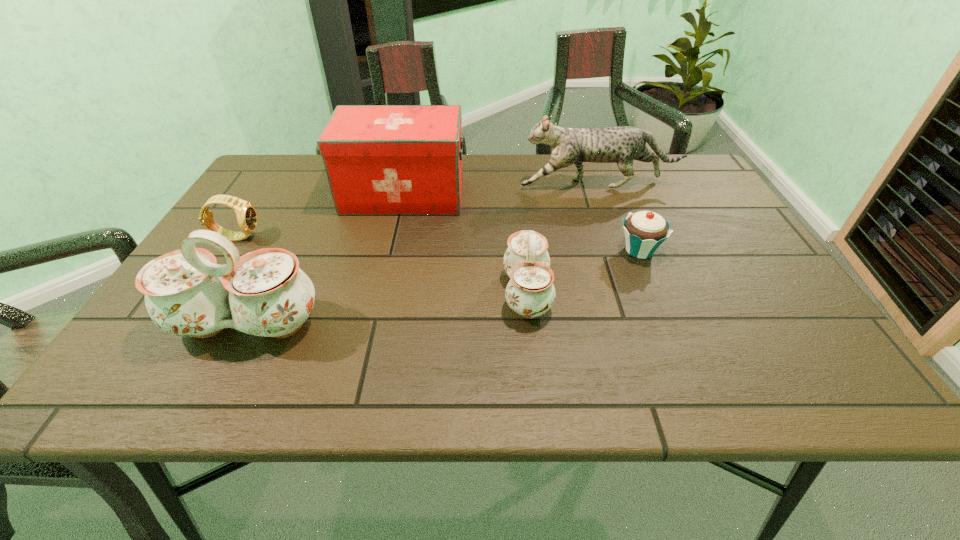
Identify the location of vacant area that satisfies the following two spatial constraints: 1. on the handle side of the cupcake; 2. on the right side of the first-aid kit. The width and height of the screenshot is (960, 540). (391, 251).

This screenshot has height=540, width=960. Find the location of `free space that satisfies the following two spatial constraints: 1. on the face of the cupcake; 2. on the left side of the watch`. free space that satisfies the following two spatial constraints: 1. on the face of the cupcake; 2. on the left side of the watch is located at coordinates (228, 251).

Locate an element on the screen. This screenshot has width=960, height=540. free location that satisfies the following two spatial constraints: 1. on the handle side of the first-aid kit; 2. by the handle of the left chinaware is located at coordinates (373, 325).

At what (x,y) coordinates should I click in order to perform the action: click on vacant space that satisfies the following two spatial constraints: 1. by the handle of the right chinaware; 2. by the handle of the left chinaware. Please return your answer as a coordinate pair (x, y). Looking at the image, I should click on (530, 325).